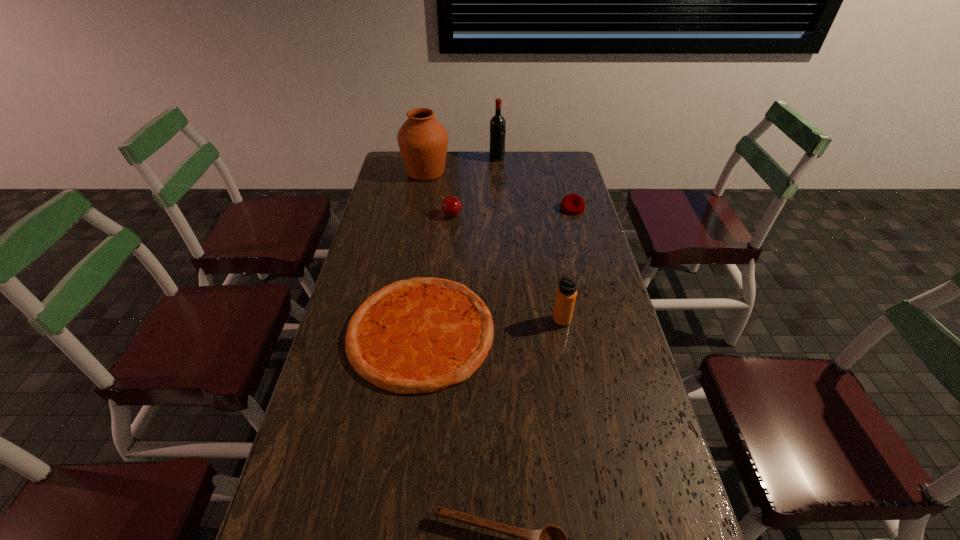
You are a GUI agent. You are given a task and a screenshot of the screen. Output one action in this format:
    pyautogui.click(x=<x>, y=<y>)
    Task: Click on the free spot located on the left of the second object from right to left
    
    Given the screenshot: What is the action you would take?
    pyautogui.click(x=438, y=321)

Identify the location of free space located on the left of the cherry. [415, 215].

In order to click on free point located on the seat area of the beanbag in this screenshot , I will do `click(586, 258)`.

This screenshot has width=960, height=540. Identify the location of vacant space located 0.150m on the back of the pizza. (431, 252).

Identify the location of wine bottle present at the far edge. The height and width of the screenshot is (540, 960). pyautogui.click(x=497, y=123).

Locate an element on the screen. urn that is at the far edge is located at coordinates (423, 140).

This screenshot has width=960, height=540. Identify the location of urn at the left edge. (423, 140).

At what (x,y) coordinates should I click in order to perform the action: click on pizza that is positioned at the left edge. Please return your answer as a coordinate pair (x, y). The width and height of the screenshot is (960, 540). Looking at the image, I should click on (421, 335).

The image size is (960, 540). I want to click on thermos bottle at the right edge, so click(566, 294).

Where is `beanbag that is at the right edge`? The image size is (960, 540). beanbag that is at the right edge is located at coordinates (572, 204).